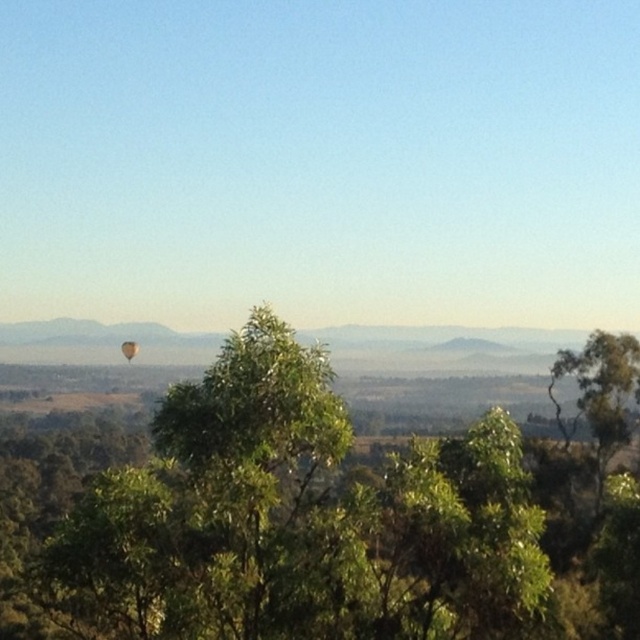
Is green leafy tree at right positioned at the back of orange fabric hot air balloon at center?

No, it is not.

Identify the location of green leafy tree at right. (600, 392).

You are a GUI agent. You are given a task and a screenshot of the screen. Output one action in this format:
    pyautogui.click(x=<x>, y=<y>)
    Task: Click on the green leafy tree at right
    
    Given the screenshot: What is the action you would take?
    coord(600,392)

This screenshot has width=640, height=640. What do you see at coordinates (300, 522) in the screenshot?
I see `green leafy tree at center` at bounding box center [300, 522].

This screenshot has width=640, height=640. Identify the location of green leafy tree at center. (300, 522).

Looking at this image, which of these two, green leafy tree at center or green leafy tree at right, stands shorter?

Standing shorter between the two is green leafy tree at right.

Is green leafy tree at center to the right of green leafy tree at right from the viewer's perspective?

In fact, green leafy tree at center is to the left of green leafy tree at right.

Is point (250, 344) positioned after point (616, 412)?

No, it is in front of (616, 412).

Locate an element on the screen. The image size is (640, 640). green leafy tree at center is located at coordinates (300, 522).